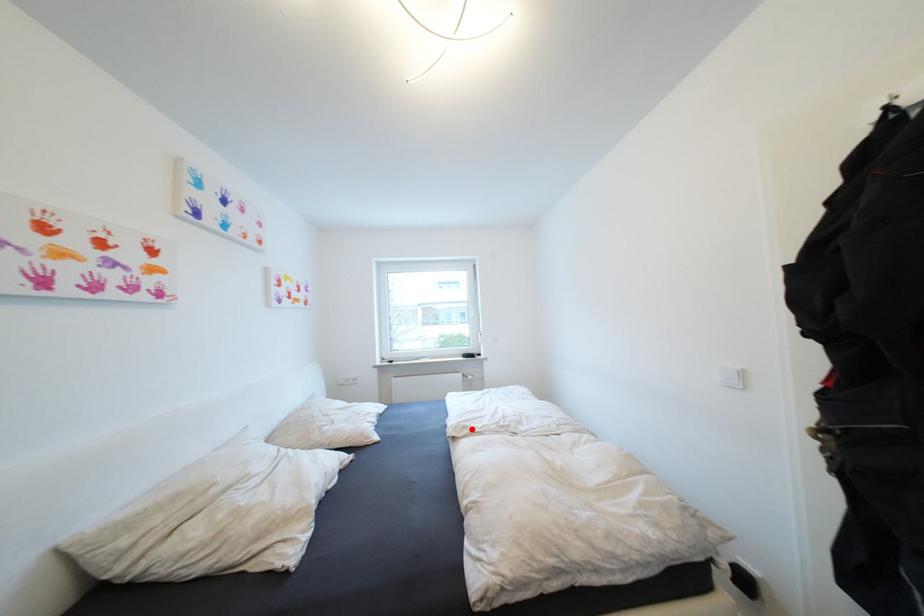
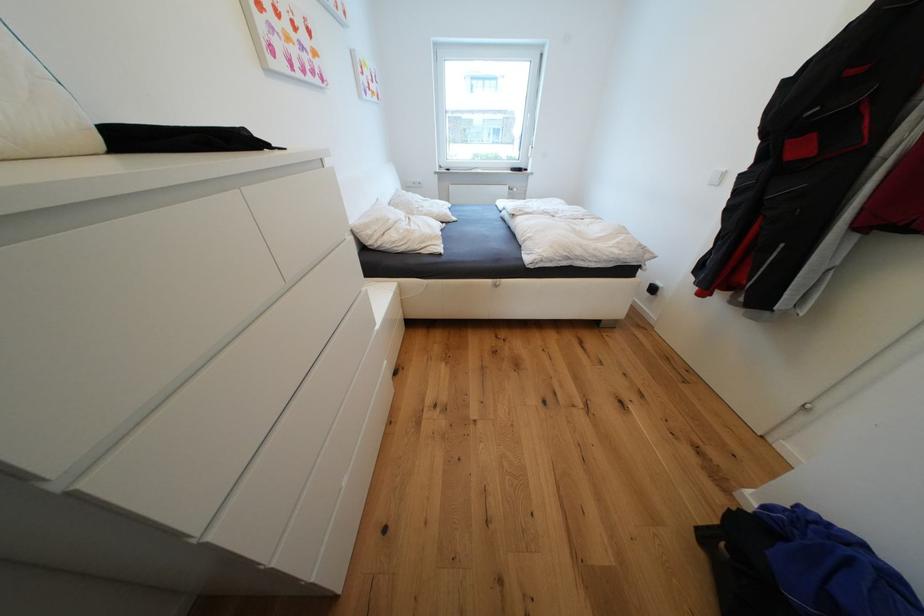
Question: I am providing you with two images of the same scene from different viewpoints. In image1, a red point is highlighted. Considering the same 3D point in image2, which of the following is correct?

Choices:
 (A) It is closer
 (B) It is farther

Answer: (A)